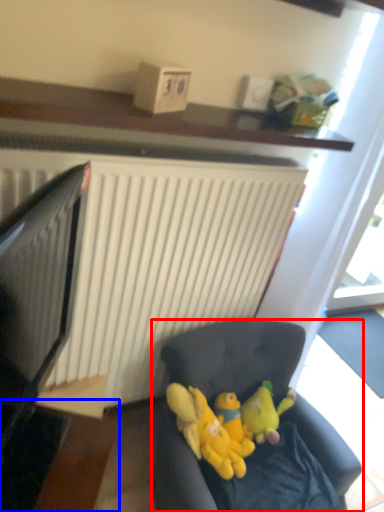
Question: Which object is further to the camera taking this photo, studio couch (highlighted by a red box) or table (highlighted by a blue box)?

Choices:
 (A) studio couch
 (B) table

Answer: (A)